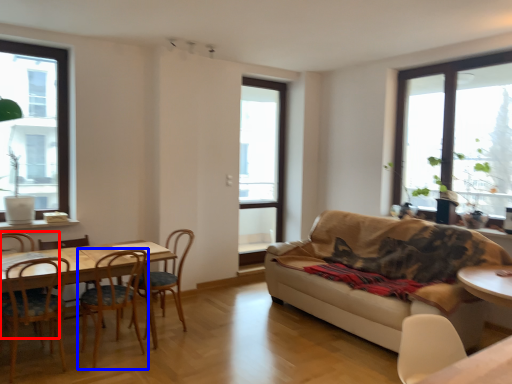
Question: Which object appears closest to the camera in this image, chair (highlighted by a red box) or chair (highlighted by a blue box)?

Choices:
 (A) chair
 (B) chair

Answer: (B)